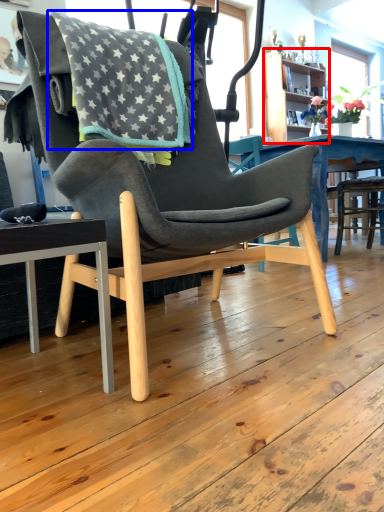
Question: Which of the following is the farthest to the observer, bookshelf (highlighted by a red box) or blanket (highlighted by a blue box)?

Choices:
 (A) bookshelf
 (B) blanket

Answer: (A)